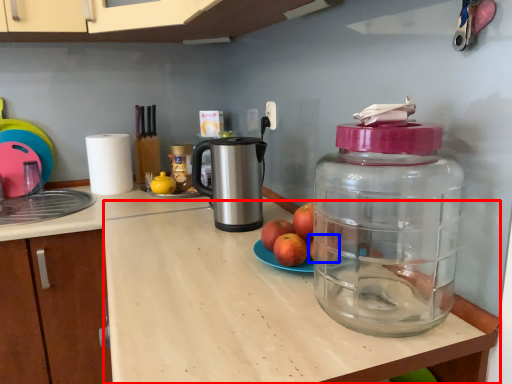
Question: Which point is further to the camera, counter top (highlighted by a red box) or apple (highlighted by a blue box)?

Choices:
 (A) counter top
 (B) apple

Answer: (B)